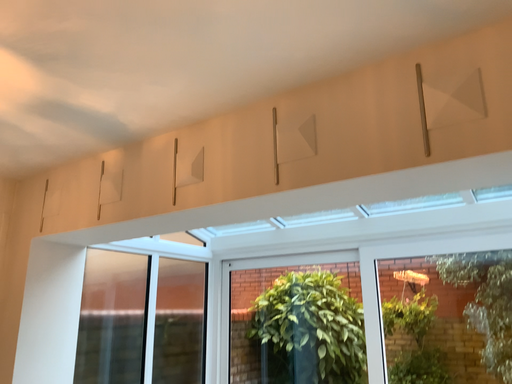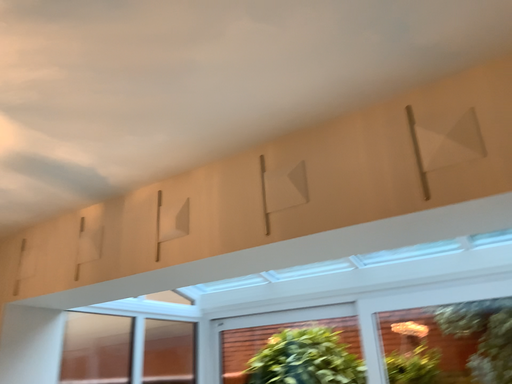
Question: How did the camera likely rotate when shooting the video?

Choices:
 (A) rotated upward
 (B) rotated downward

Answer: (A)